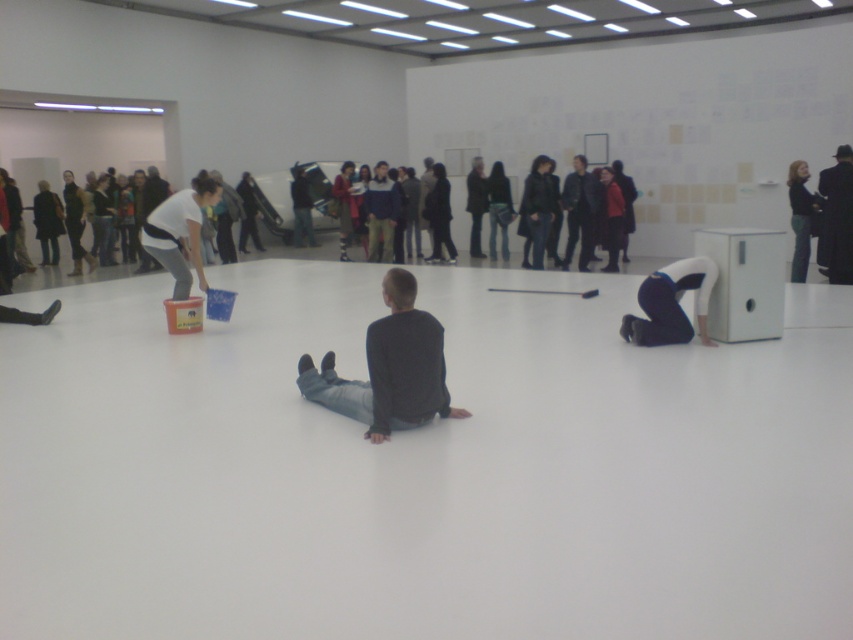
You are an art curator walking through the gallery and need to place a 10 foot long sculpture between the dark blue fabric pants at lower right and the matte white shirt at left. Is there enough space between them to fit the sculpture?

The distance between the dark blue fabric pants at lower right and the matte white shirt at left is 12.93 feet, which is greater than the 10 foot length of the sculpture. Therefore, there is enough space to place the sculpture between them.

You are an art curator organizing an exhibition. You have two items to display in the gallery shown in the image. The items are the black leather hat at upper right and the black leather jacket at upper right. Since both items are at the same location, which item should you choose to place on a small pedestal to ensure it is clearly visible to visitors?

You should choose the black leather hat at upper right because it has a larger size compared to the black leather jacket at upper right, making it more visible on a small pedestal.